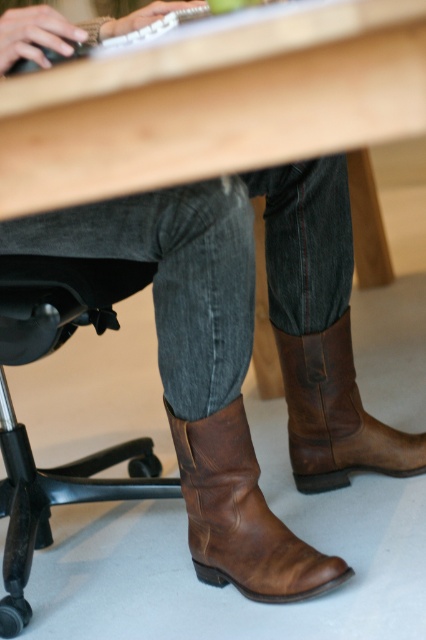
Does brown leather cowboy boot at lower center lie in front of brown leather cowboy boot at lower right?

Yes.

Does point (224, 515) come farther from viewer compared to point (304, 384)?

No, it is not.

Is point (230, 440) positioned after point (333, 422)?

No.

The height and width of the screenshot is (640, 426). I want to click on brown leather cowboy boot at lower center, so click(241, 515).